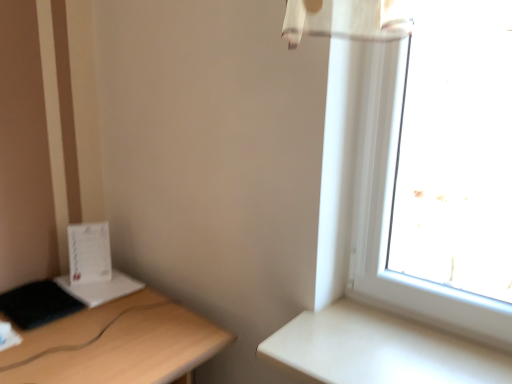
Image resolution: width=512 pixels, height=384 pixels. What do you see at coordinates (116, 344) in the screenshot? I see `light wood desk at left` at bounding box center [116, 344].

The image size is (512, 384). What are the coordinates of `light wood desk at left` in the screenshot? It's located at (116, 344).

Where is `white matte table at right`? The width and height of the screenshot is (512, 384). white matte table at right is located at coordinates (377, 350).

The image size is (512, 384). What do you see at coordinates (377, 350) in the screenshot? I see `white matte table at right` at bounding box center [377, 350].

Measure the distance between white matte table at right and camera.

white matte table at right and camera are 36.83 inches apart from each other.

You are a GUI agent. You are given a task and a screenshot of the screen. Output one action in this format:
    pyautogui.click(x=<x>, y=<y>)
    Task: Click on the light wood desk at left
    Image resolution: width=512 pixels, height=384 pixels.
    Given the screenshot: What is the action you would take?
    pyautogui.click(x=116, y=344)

In the scene shown: Which object is positioned more to the right, light wood desk at left or white matte table at right?

white matte table at right is more to the right.

Consider the image. Between light wood desk at left and white matte table at right, which one is positioned in front?

Positioned in front is light wood desk at left.

Between point (204, 320) and point (315, 355), which one is positioned in front?

The point (315, 355) is in front.

From the image's perspective, which one is positioned higher, light wood desk at left or white matte table at right?

white matte table at right appears higher in the image.

From a real-world perspective, between light wood desk at left and white matte table at right, who is vertically lower?

light wood desk at left, from a real-world perspective.

Looking at their sizes, would you say light wood desk at left is wider or thinner than white matte table at right?

Considering their sizes, light wood desk at left looks broader than white matte table at right.

Considering the sizes of objects light wood desk at left and white matte table at right in the image provided, who is shorter, light wood desk at left or white matte table at right?

Standing shorter between the two is white matte table at right.

Can you confirm if light wood desk at left is smaller than white matte table at right?

Incorrect, light wood desk at left is not smaller in size than white matte table at right.

Can we say light wood desk at left lies outside white matte table at right?

Yes.

Is light wood desk at left not near white matte table at right?

No, there isn't a large distance between light wood desk at left and white matte table at right.

Is light wood desk at left aimed at white matte table at right?

Yes, light wood desk at left is turned towards white matte table at right.

How different are the orientations of light wood desk at left and white matte table at right in degrees?

light wood desk at left and white matte table at right are facing 86.2 degrees away from each other.

At what (x,y) coordinates should I click in order to perform the action: click on table to the right of light wood desk at left. Please return your answer as a coordinate pair (x, y). Looking at the image, I should click on (377, 350).

Which object is positioned more to the right, white matte table at right or light wood desk at left?

white matte table at right.

Does white matte table at right come behind light wood desk at left?

Yes, it is.

Considering the positions of points (321, 364) and (63, 326), is point (321, 364) farther from camera compared to point (63, 326)?

No, (321, 364) is closer to viewer.

From the image's perspective, who appears lower, white matte table at right or light wood desk at left?

From the image's view, light wood desk at left is below.

From a real-world perspective, relative to light wood desk at left, is white matte table at right vertically above or below?

white matte table at right is above light wood desk at left.

Considering the sizes of objects white matte table at right and light wood desk at left in the image provided, who is thinner, white matte table at right or light wood desk at left?

white matte table at right is thinner.

Considering the sizes of objects white matte table at right and light wood desk at left in the image provided, who is taller, white matte table at right or light wood desk at left?

light wood desk at left.

Who is bigger, white matte table at right or light wood desk at left?

Bigger between the two is light wood desk at left.

Could light wood desk at left be considered to be inside white matte table at right?

No, white matte table at right does not contain light wood desk at left.

Is white matte table at right positioned far away from light wood desk at left?

No, white matte table at right is not far from light wood desk at left.

Looking at this image, is white matte table at right looking in the opposite direction of light wood desk at left?

That's not correct — white matte table at right is not looking away from light wood desk at left.

Can you tell me how much white matte table at right and light wood desk at left differ in facing direction?

white matte table at right and light wood desk at left are facing 86.2 degrees away from each other.

At what (x,y) coordinates should I click in order to perform the action: click on table that is above the light wood desk at left (from the image's perspective). Please return your answer as a coordinate pair (x, y). The image size is (512, 384). Looking at the image, I should click on (377, 350).

I want to click on table above the light wood desk at left (from the image's perspective), so click(377, 350).

I want to click on table on the right of light wood desk at left, so click(x=377, y=350).